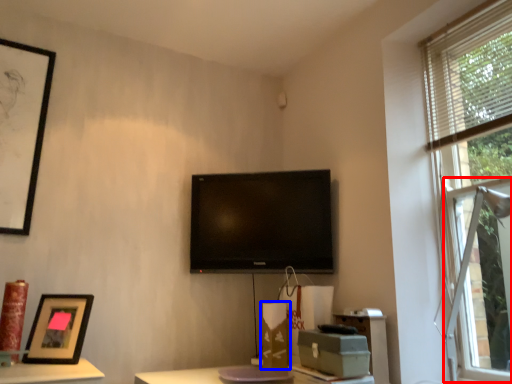
Question: Which point is further to the camera, bay window (highlighted by a red box) or cardboard box (highlighted by a blue box)?

Choices:
 (A) bay window
 (B) cardboard box

Answer: (B)